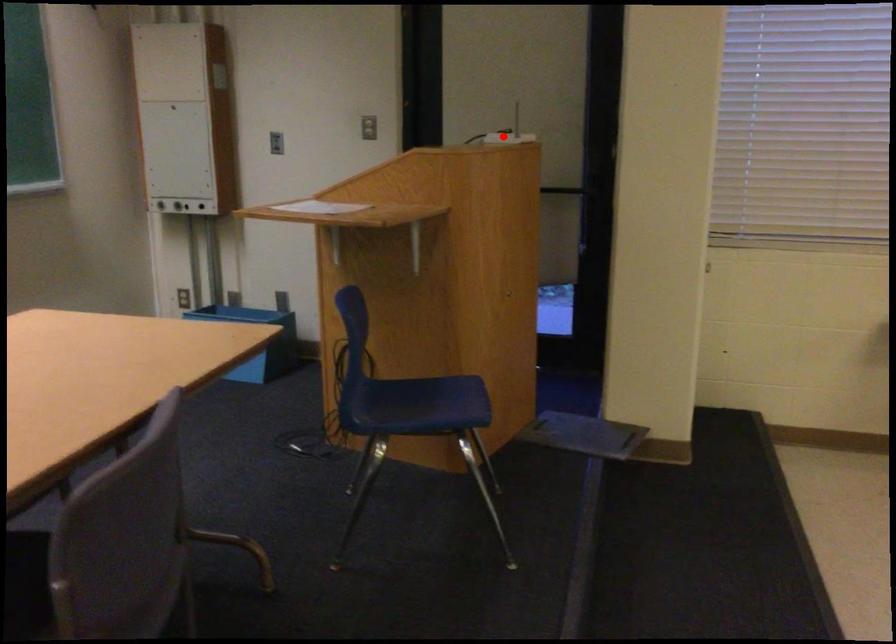
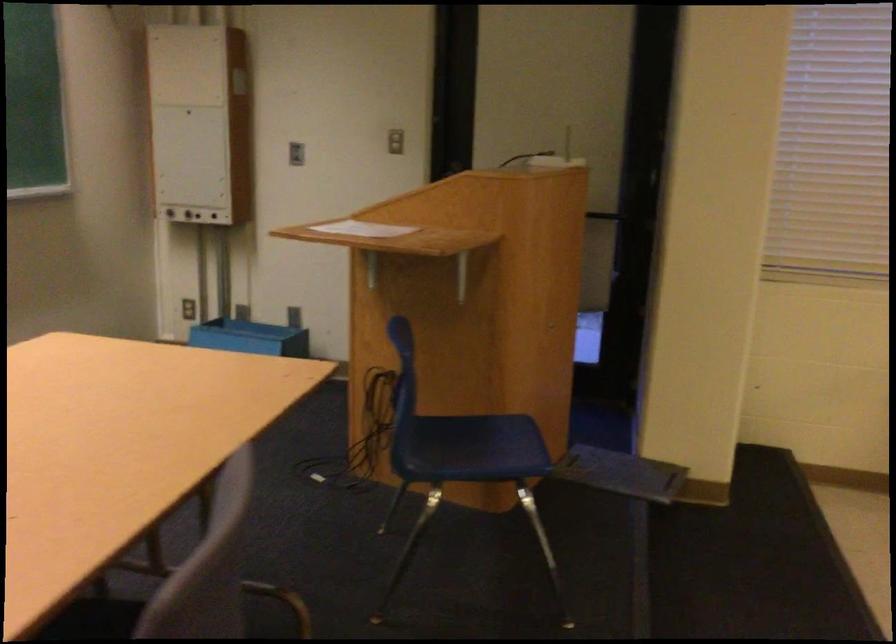
Question: I am providing you with two images of the same scene from different viewpoints. A red point is marked on the first image. Can you still see the location of the red point in image 2?

Choices:
 (A) Yes
 (B) No

Answer: (B)